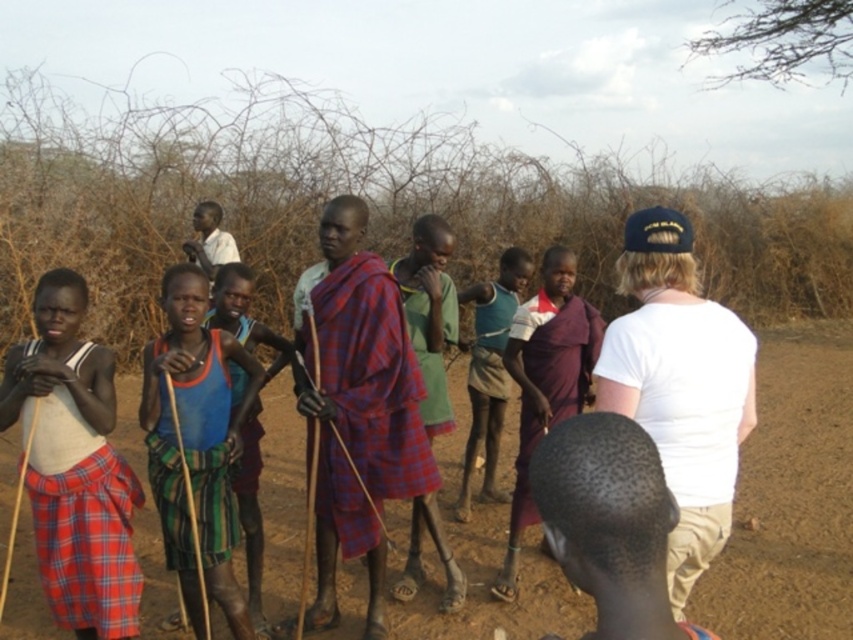
Question: Is brown dirt field at center positioned behind blue-green fabric at center?

Choices:
 (A) yes
 (B) no

Answer: (A)

Question: Which point appears closest to the camera in this image?

Choices:
 (A) 495,324
 (B) 289,396
 (C) 196,362

Answer: (C)

Question: Which point is farther to the camera?

Choices:
 (A) teal fabric shirt at center
 (B) blue-green fabric at center
 (C) brown dirt field at center

Answer: (A)

Question: Where is brown dirt field at center located in relation to teal fabric shirt at center in the image?

Choices:
 (A) above
 (B) below

Answer: (B)

Question: Which object is the closest to the blue-green fabric at center?

Choices:
 (A) teal fabric shirt at center
 (B) brown dirt field at center

Answer: (B)

Question: Is brown dirt field at center in front of teal fabric shirt at center?

Choices:
 (A) yes
 (B) no

Answer: (A)